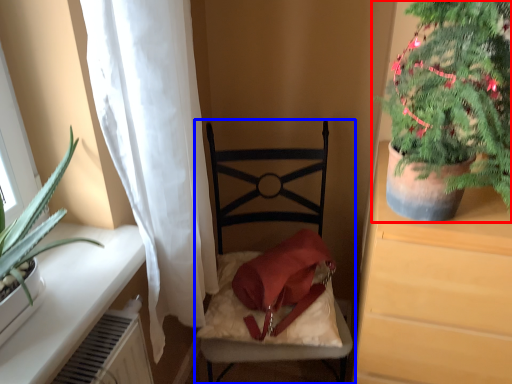
Question: Which of the following is the closest to the observer, houseplant (highlighted by a red box) or chair (highlighted by a blue box)?

Choices:
 (A) houseplant
 (B) chair

Answer: (A)